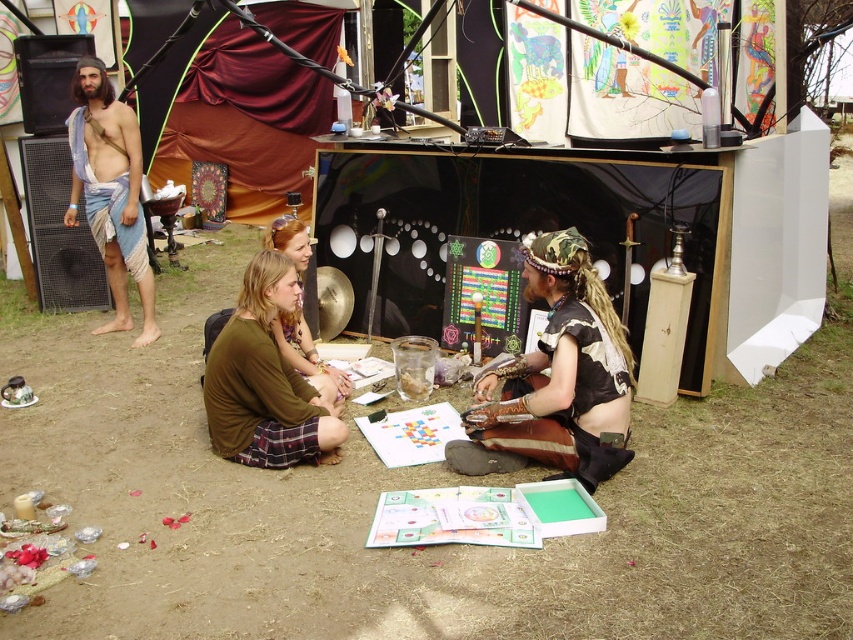
You are organizing a small gathering and need to place a decorative item on the ground between the black leather skirt at center and the blue fabric cloth at left. Which object should you place closer to the wider one to ensure stability?

The black leather skirt at center is wider than the blue fabric cloth at left, so place the decorative item closer to the black leather skirt at center for better stability.

You are trying to decide which clothing item to take with you for the festival. Given that you have limited space in your bag, which item from the image would you choose between the brown plaid skirt at center and the brown fabric shirt at center?

The brown plaid skirt at center is smaller than the brown fabric shirt at center, so you should choose the brown plaid skirt at center as it takes up less space in your bag.

Consider the image. You are a photographer trying to capture a candid shot of the two people sitting at the center of the scene. The camera you are using has a maximum focus range of 1.2 meters. Can you take a photo that includes both the black leather skirt at center and the brown fabric shirt at center without moving your position?

The black leather skirt at center and brown fabric shirt at center are 1.16 meters apart from each other. Since the distance between them is within the camera maximum focus range of 1.2 meters, you can take a photo that includes both without moving your position.